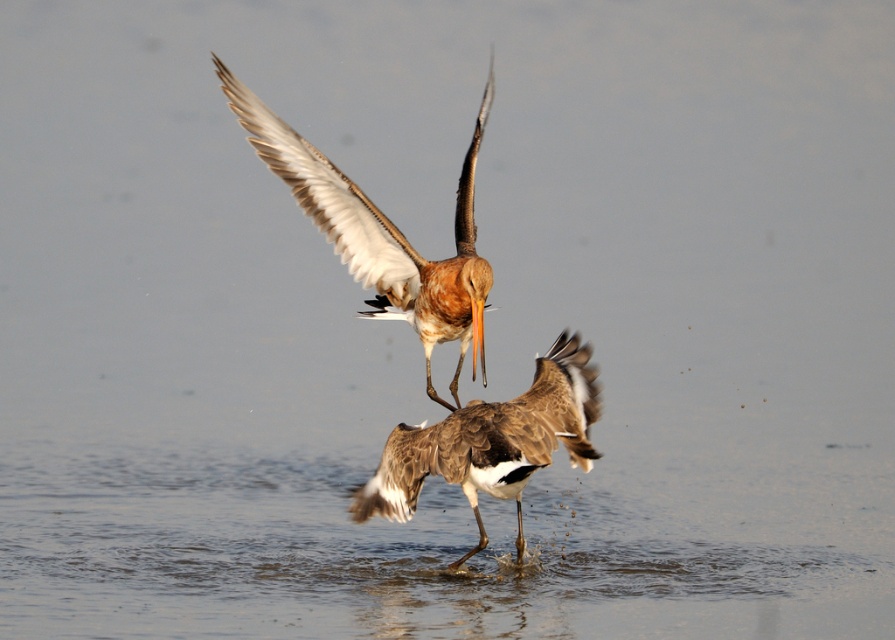
Is brown feathered bird at center smaller than brown speckled feathers at center?

Incorrect, brown feathered bird at center is not smaller in size than brown speckled feathers at center.

Between brown feathered bird at center and brown speckled feathers at center, which one is positioned lower?

brown speckled feathers at center is lower down.

This screenshot has height=640, width=895. What do you see at coordinates (381, 234) in the screenshot?
I see `brown feathered bird at center` at bounding box center [381, 234].

Find the location of `brown feathered bird at center`. brown feathered bird at center is located at coordinates (381, 234).